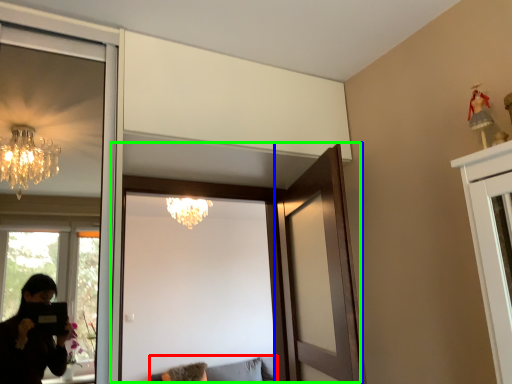
Question: Which object is the closest to the furniture (highlighted by a red box)? Choose among these: door (highlighted by a blue box) or door (highlighted by a green box).

Choices:
 (A) door
 (B) door

Answer: (B)